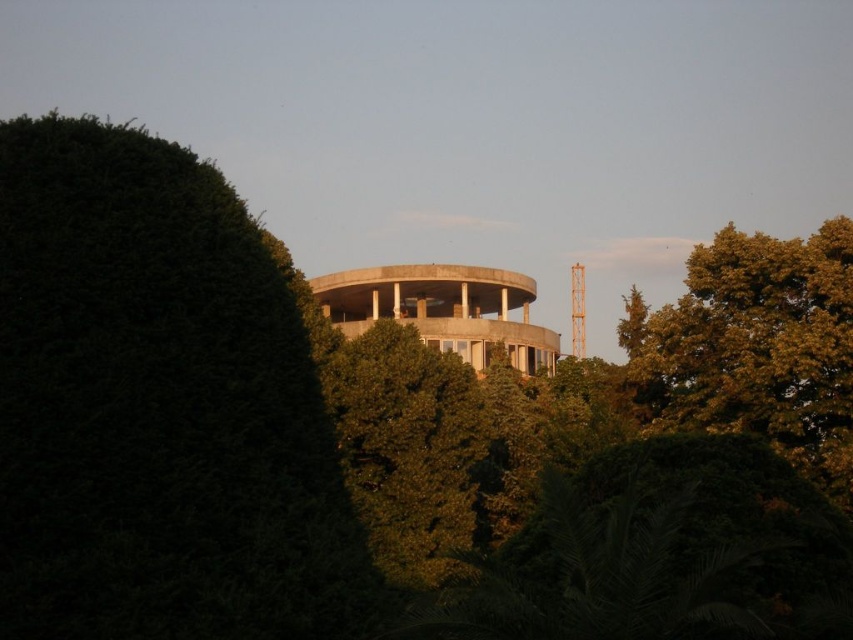
Question: Which point is farther to the camera?

Choices:
 (A) green leafy bush at upper left
 (B) green leafy tree at upper right

Answer: (B)

Question: From the image, what is the correct spatial relationship of green leafy bush at upper left in relation to green leafy tree at upper right?

Choices:
 (A) below
 (B) above

Answer: (B)

Question: Does green leafy bush at upper left lie behind green leafy tree at upper right?

Choices:
 (A) no
 (B) yes

Answer: (A)

Question: Which of the following is the farthest from the observer?

Choices:
 (A) (47, 269)
 (B) (827, 332)

Answer: (B)

Question: Where is green leafy bush at upper left located in relation to green leafy tree at upper right in the image?

Choices:
 (A) left
 (B) right

Answer: (A)

Question: Which point is closer to the camera?

Choices:
 (A) green leafy bush at upper left
 (B) green leafy tree at upper right

Answer: (A)